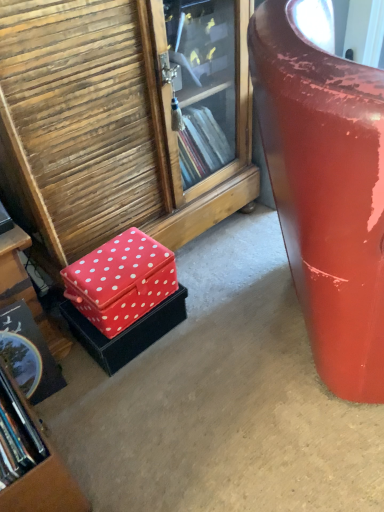
Identify the location of empty space that is ontop of red fabric box at lower left, the 2th box in the bottom-to-top sequence (from a real-world perspective). This screenshot has width=384, height=512. (112, 263).